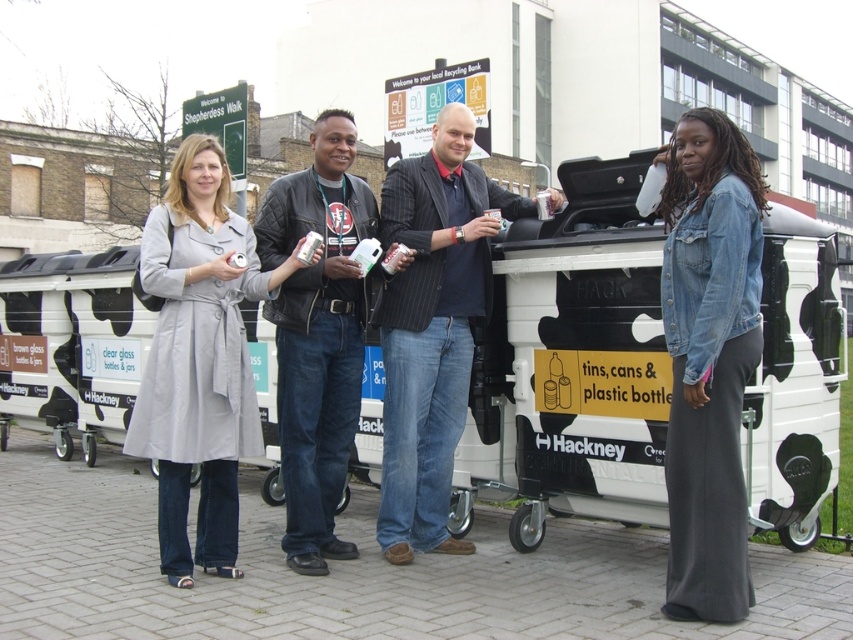
Is light gray coat at center taller than black leather jacket at center?

Indeed, light gray coat at center has a greater height compared to black leather jacket at center.

Which of these two, light gray coat at center or black leather jacket at center, stands shorter?

Standing shorter between the two is black leather jacket at center.

Between point (216, 305) and point (318, 392), which one is positioned in front?

Point (216, 305)

You are a GUI agent. You are given a task and a screenshot of the screen. Output one action in this format:
    pyautogui.click(x=<x>, y=<y>)
    Task: Click on the light gray coat at center
    
    Given the screenshot: What is the action you would take?
    pyautogui.click(x=199, y=356)

Is point (732, 131) positioned after point (482, 243)?

No.

In the scene shown: Does denim jacket at lower right have a larger size compared to dark blue pinstripe blazer at center?

No.

Which is in front, point (670, 420) or point (409, 467)?

Point (670, 420) is more forward.

Locate an element on the screen. This screenshot has height=640, width=853. denim jacket at lower right is located at coordinates (709, 358).

Does light gray coat at center have a smaller size compared to dark blue pinstripe blazer at center?

Yes, light gray coat at center is smaller than dark blue pinstripe blazer at center.

Who is positioned more to the right, light gray coat at center or dark blue pinstripe blazer at center?

Positioned to the right is dark blue pinstripe blazer at center.

Does point (183, 449) come closer to viewer compared to point (408, 240)?

Yes, point (183, 449) is closer to viewer.

I want to click on light gray coat at center, so click(199, 356).